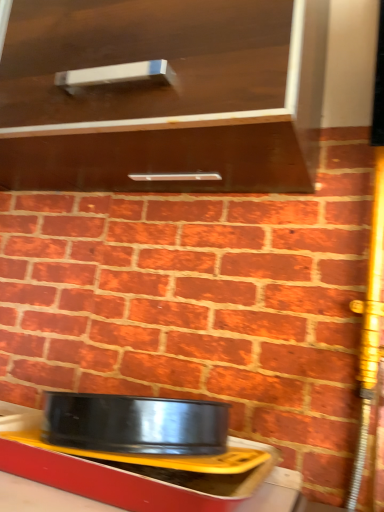
At what (x,y) coordinates should I click in order to perform the action: click on metallic yellow tray at lower center. Please return your answer as a coordinate pair (x, y). This screenshot has height=512, width=384. Looking at the image, I should click on (156, 482).

What do you see at coordinates (156, 482) in the screenshot? The height and width of the screenshot is (512, 384). I see `metallic yellow tray at lower center` at bounding box center [156, 482].

This screenshot has width=384, height=512. What do you see at coordinates (163, 94) in the screenshot?
I see `matte brown cabinet at upper center` at bounding box center [163, 94].

This screenshot has width=384, height=512. I want to click on matte brown cabinet at upper center, so click(163, 94).

Find the location of `metallic yellow tray at lower center`. metallic yellow tray at lower center is located at coordinates (156, 482).

Considering the relative positions of matte brown cabinet at upper center and metallic yellow tray at lower center in the image provided, is matte brown cabinet at upper center to the right of metallic yellow tray at lower center from the viewer's perspective?

No, matte brown cabinet at upper center is not to the right of metallic yellow tray at lower center.

Is the depth of matte brown cabinet at upper center greater than that of metallic yellow tray at lower center?

No, it is not.

Which is less distant, (46, 81) or (272, 469)?

Point (46, 81) is positioned closer to the camera compared to point (272, 469).

From the picture: From the image's perspective, who appears lower, matte brown cabinet at upper center or metallic yellow tray at lower center?

metallic yellow tray at lower center appears lower in the image.

From a real-world perspective, who is located higher, matte brown cabinet at upper center or metallic yellow tray at lower center?

matte brown cabinet at upper center.

In terms of width, does matte brown cabinet at upper center look wider or thinner when compared to metallic yellow tray at lower center?

Clearly, matte brown cabinet at upper center has more width compared to metallic yellow tray at lower center.

From the picture: Is matte brown cabinet at upper center taller or shorter than metallic yellow tray at lower center?

matte brown cabinet at upper center is taller than metallic yellow tray at lower center.

Who is smaller, matte brown cabinet at upper center or metallic yellow tray at lower center?

With smaller size is metallic yellow tray at lower center.

Would you say matte brown cabinet at upper center is inside or outside metallic yellow tray at lower center?

matte brown cabinet at upper center is outside metallic yellow tray at lower center.

Is matte brown cabinet at upper center next to metallic yellow tray at lower center?

There is a gap between matte brown cabinet at upper center and metallic yellow tray at lower center.

In the scene shown: Is matte brown cabinet at upper center oriented away from metallic yellow tray at lower center?

matte brown cabinet at upper center is not turned away from metallic yellow tray at lower center.

Can you tell me how much matte brown cabinet at upper center and metallic yellow tray at lower center differ in facing direction?

matte brown cabinet at upper center and metallic yellow tray at lower center are facing 0.441 degrees away from each other.

Image resolution: width=384 pixels, height=512 pixels. What are the coordinates of `table that appears below the matte brown cabinet at upper center (from the image's perspective)` in the screenshot? It's located at (156, 482).

Considering the positions of objects metallic yellow tray at lower center and matte brown cabinet at upper center in the image provided, who is more to the right, metallic yellow tray at lower center or matte brown cabinet at upper center?

Positioned to the right is metallic yellow tray at lower center.

Based on the photo, which is in front, metallic yellow tray at lower center or matte brown cabinet at upper center?

matte brown cabinet at upper center.

Between point (15, 448) and point (258, 6), which one is positioned behind?

The point (15, 448) is farther.

From the image's perspective, relative to matte brown cabinet at upper center, is metallic yellow tray at lower center above or below?

Based on their image positions, metallic yellow tray at lower center is located beneath matte brown cabinet at upper center.

From a real-world perspective, is metallic yellow tray at lower center beneath matte brown cabinet at upper center?

Yes, from a real-world perspective, metallic yellow tray at lower center is under matte brown cabinet at upper center.

Considering the sizes of metallic yellow tray at lower center and matte brown cabinet at upper center in the image, is metallic yellow tray at lower center wider or thinner than matte brown cabinet at upper center?

Considering their sizes, metallic yellow tray at lower center looks slimmer than matte brown cabinet at upper center.

Between metallic yellow tray at lower center and matte brown cabinet at upper center, which one has less height?

metallic yellow tray at lower center is shorter.

Can you confirm if metallic yellow tray at lower center is smaller than matte brown cabinet at upper center?

Correct, metallic yellow tray at lower center occupies less space than matte brown cabinet at upper center.

Is metallic yellow tray at lower center outside of matte brown cabinet at upper center?

Yes.

Is metallic yellow tray at lower center not close to matte brown cabinet at upper center?

No, metallic yellow tray at lower center is not far away from matte brown cabinet at upper center.

Is metallic yellow tray at lower center facing away from matte brown cabinet at upper center?

metallic yellow tray at lower center does not have its back to matte brown cabinet at upper center.

How much distance is there between metallic yellow tray at lower center and matte brown cabinet at upper center?

metallic yellow tray at lower center is 50.38 centimeters away from matte brown cabinet at upper center.

The image size is (384, 512). I want to click on table that is behind the matte brown cabinet at upper center, so click(x=156, y=482).

The height and width of the screenshot is (512, 384). In order to click on cabinetry above the metallic yellow tray at lower center (from a real-world perspective) in this screenshot , I will do `click(163, 94)`.

This screenshot has height=512, width=384. In order to click on cabinetry in front of the metallic yellow tray at lower center in this screenshot , I will do (163, 94).